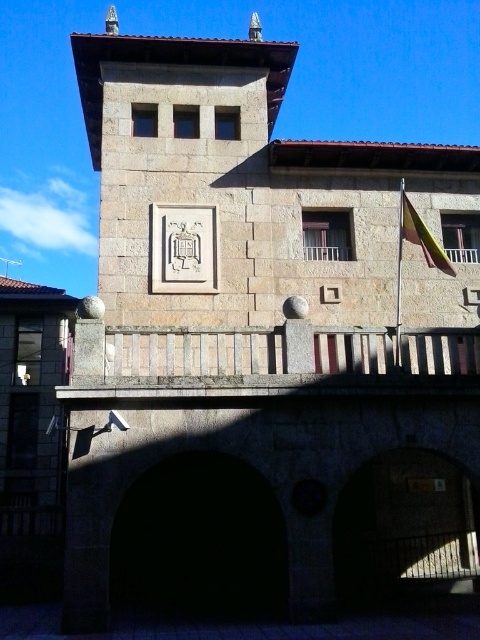
Between point (176, 248) and point (403, 195), which one is positioned behind?

The point (176, 248) is more distant.

At what (x,y) coordinates should I click in order to perform the action: click on white stone clock at center. Please return your answer as a coordinate pair (x, y). The height and width of the screenshot is (640, 480). Looking at the image, I should click on (183, 248).

The image size is (480, 640). Identify the location of white stone clock at center. (183, 248).